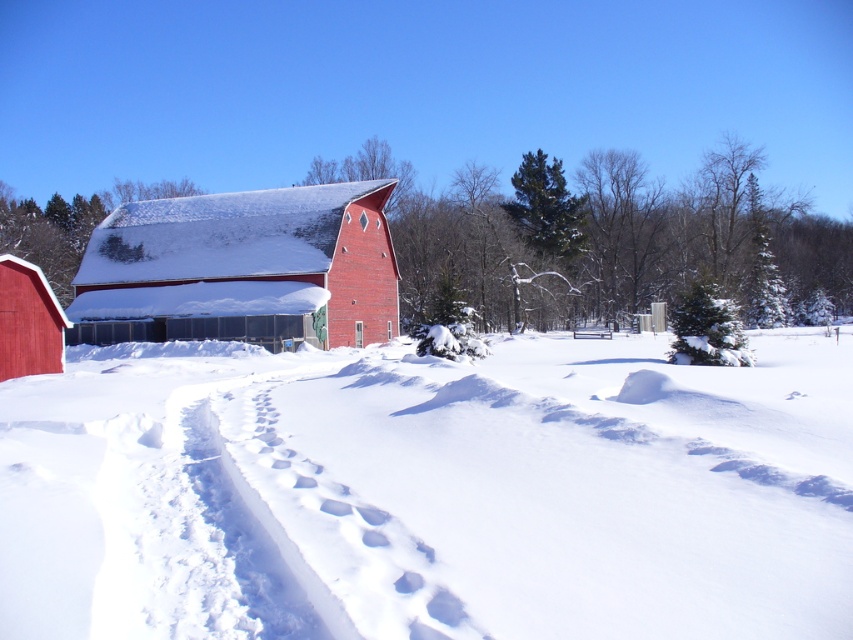
The height and width of the screenshot is (640, 853). I want to click on white fluffy snow at center, so click(431, 492).

Can you confirm if matte red barn at center is shorter than matte red barn at lower left?

No, matte red barn at center is not shorter than matte red barn at lower left.

You are a GUI agent. You are given a task and a screenshot of the screen. Output one action in this format:
    pyautogui.click(x=<x>, y=<y>)
    Task: Click on the matte red barn at center
    
    Given the screenshot: What is the action you would take?
    pyautogui.click(x=242, y=268)

Is white fluffy snow at center below matte red barn at center?

Correct, white fluffy snow at center is located below matte red barn at center.

Looking at this image, who is more distant from viewer, (703, 550) or (193, 260)?

Positioned behind is point (193, 260).

I want to click on white fluffy snow at center, so click(431, 492).